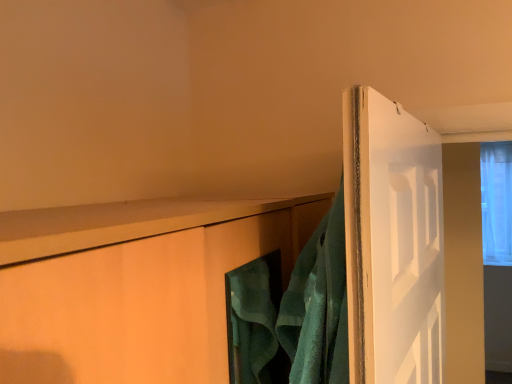
Question: Looking at their shapes, would you say green terry cloth towel at upper right is wider or thinner than transparent glass window at upper right?

Choices:
 (A) wide
 (B) thin

Answer: (B)

Question: From a real-world perspective, is green terry cloth towel at upper right physically located above or below transparent glass window at upper right?

Choices:
 (A) below
 (B) above

Answer: (A)

Question: From the image's perspective, relative to transparent glass window at upper right, is green terry cloth towel at upper right above or below?

Choices:
 (A) below
 (B) above

Answer: (A)

Question: Does point (510, 147) appear closer or farther from the camera than point (327, 354)?

Choices:
 (A) farther
 (B) closer

Answer: (A)

Question: In the image, is transparent glass window at upper right positioned in front of or behind green terry cloth towel at upper right?

Choices:
 (A) front
 (B) behind

Answer: (B)

Question: In terms of height, does transparent glass window at upper right look taller or shorter compared to green terry cloth towel at upper right?

Choices:
 (A) short
 (B) tall

Answer: (B)

Question: Would you say transparent glass window at upper right is inside or outside green terry cloth towel at upper right?

Choices:
 (A) outside
 (B) inside

Answer: (A)